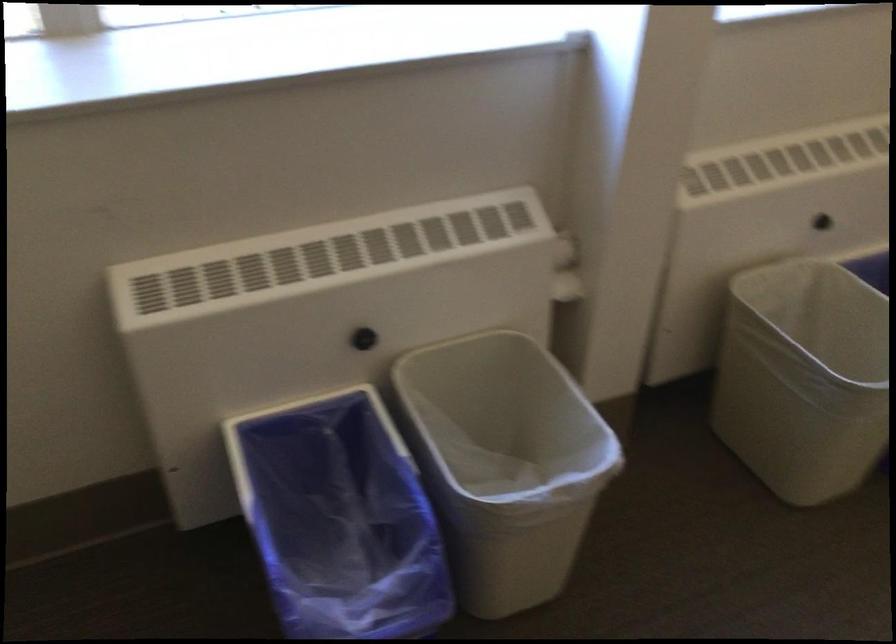
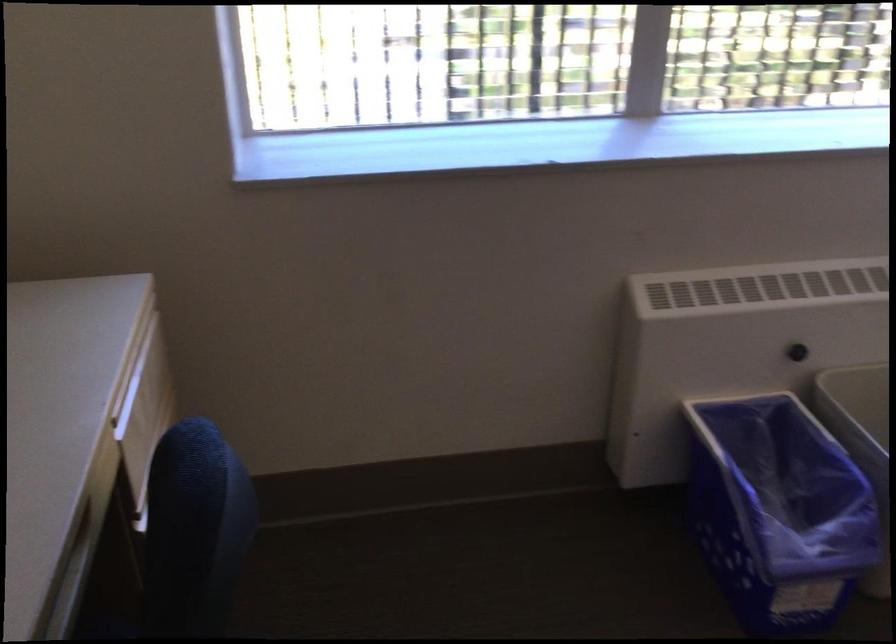
Find the pixel in the second image that matches point 364,493 in the first image.

(776, 476)